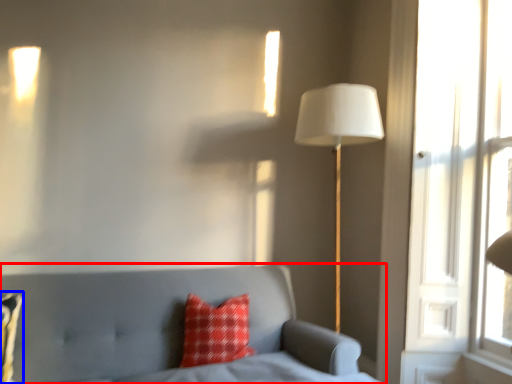
Question: Among these objects, which one is farthest to the camera, furniture (highlighted by a red box) or pillow (highlighted by a blue box)?

Choices:
 (A) furniture
 (B) pillow

Answer: (B)